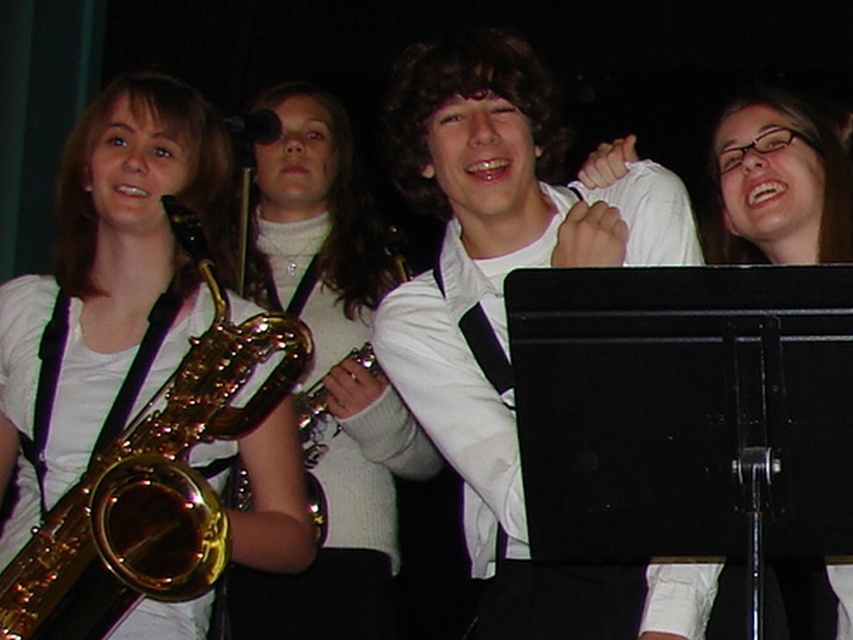
Which is above, gold shiny saxophone at left or gold shiny saxophone at center?

gold shiny saxophone at center

Is gold shiny saxophone at left smaller than gold shiny saxophone at center?

No.

Which is behind, point (119, 128) or point (267, 145)?

The point (267, 145) is behind.

Where is `gold shiny saxophone at left`? gold shiny saxophone at left is located at coordinates (103, 300).

Is point (142, 403) positioned behind point (775, 625)?

Yes.

Between gold shiny saxophone at left and clear plastic glasses at upper center, which one appears on the left side from the viewer's perspective?

gold shiny saxophone at left

Where is `gold shiny saxophone at left`? Image resolution: width=853 pixels, height=640 pixels. gold shiny saxophone at left is located at coordinates (103, 300).

Is white matte shirt at center smaller than clear plastic glasses at upper center?

No, white matte shirt at center is not smaller than clear plastic glasses at upper center.

Who is shorter, white matte shirt at center or clear plastic glasses at upper center?

clear plastic glasses at upper center is shorter.

Identify the location of white matte shirt at center. This screenshot has width=853, height=640. (502, 301).